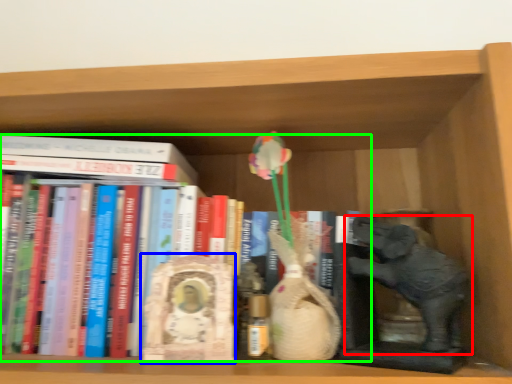
Question: Which object is the farthest from elephant (highlighted by a red box)? Choose among these: sculpture (highlighted by a blue box) or book (highlighted by a green box).

Choices:
 (A) sculpture
 (B) book

Answer: (B)